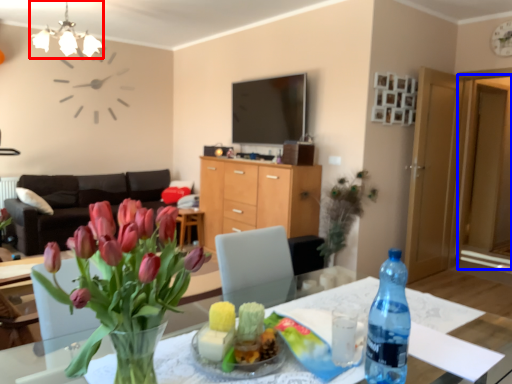
Question: Among these objects, which one is farthest to the camera, light fixture (highlighted by a red box) or glass door (highlighted by a blue box)?

Choices:
 (A) light fixture
 (B) glass door

Answer: (B)